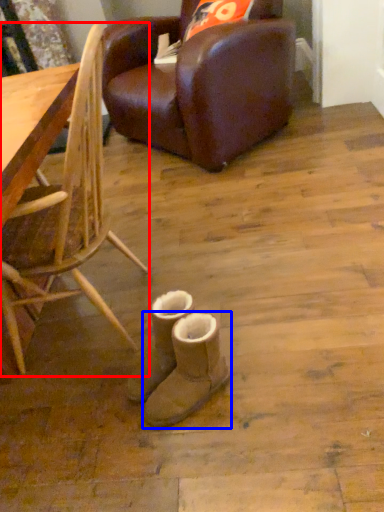
Question: Among these objects, which one is nearest to the camera, chair (highlighted by a red box) or footwear (highlighted by a blue box)?

Choices:
 (A) chair
 (B) footwear

Answer: (A)